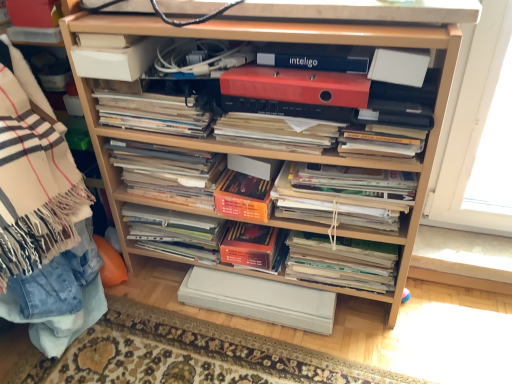
You are a GUI agent. You are given a task and a screenshot of the screen. Output one action in this format:
    pyautogui.click(x=<x>, y=<y>)
    Task: Click on the vacant point above white paper magazine at center, positioned as the third magazine in bottom-to-top order (from a real-world perspective)
    This screenshot has width=512, height=384.
    Given the screenshot: What is the action you would take?
    pyautogui.click(x=346, y=173)